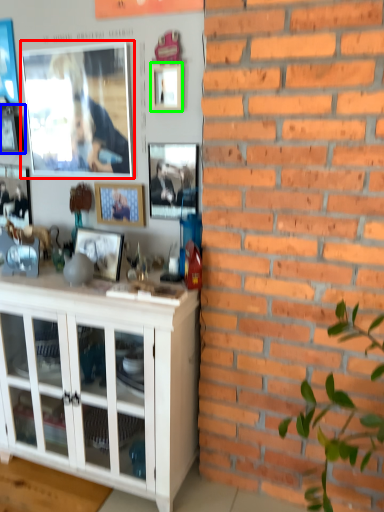
Question: Considering the real-world distances, which object is closest to picture frame (highlighted by a red box)? picture frame (highlighted by a blue box) or picture frame (highlighted by a green box).

Choices:
 (A) picture frame
 (B) picture frame

Answer: (A)